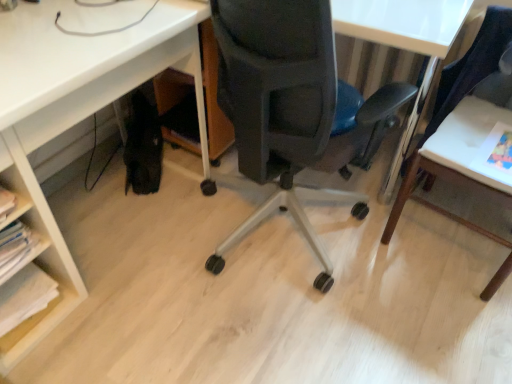
Question: Does matte black chair at center turn towards white matte desk at lower left?

Choices:
 (A) yes
 (B) no

Answer: (B)

Question: Is matte black chair at center looking in the opposite direction of white matte desk at lower left?

Choices:
 (A) yes
 (B) no

Answer: (B)

Question: Is matte black chair at center further to the viewer compared to white matte desk at lower left?

Choices:
 (A) yes
 (B) no

Answer: (B)

Question: Considering the relative sizes of matte black chair at center and white matte desk at lower left in the image provided, is matte black chair at center shorter than white matte desk at lower left?

Choices:
 (A) no
 (B) yes

Answer: (A)

Question: Is the position of matte black chair at center less distant than that of white matte desk at lower left?

Choices:
 (A) no
 (B) yes

Answer: (B)

Question: Can you see matte black chair at center touching white matte desk at lower left?

Choices:
 (A) yes
 (B) no

Answer: (B)

Question: Is white wood table at right facing away from white matte desk at lower left?

Choices:
 (A) no
 (B) yes

Answer: (A)

Question: From a real-world perspective, is white wood table at right physically above white matte desk at lower left?

Choices:
 (A) no
 (B) yes

Answer: (B)

Question: Is white wood table at right bigger than white matte desk at lower left?

Choices:
 (A) yes
 (B) no

Answer: (B)

Question: Does white wood table at right have a greater height compared to white matte desk at lower left?

Choices:
 (A) no
 (B) yes

Answer: (B)

Question: Is the surface of white wood table at right in direct contact with white matte desk at lower left?

Choices:
 (A) yes
 (B) no

Answer: (B)

Question: Is white wood table at right further to the viewer compared to white matte desk at lower left?

Choices:
 (A) no
 (B) yes

Answer: (B)

Question: From a real-world perspective, is matte black chair at center positioned under white paper at lower left based on gravity?

Choices:
 (A) no
 (B) yes

Answer: (A)